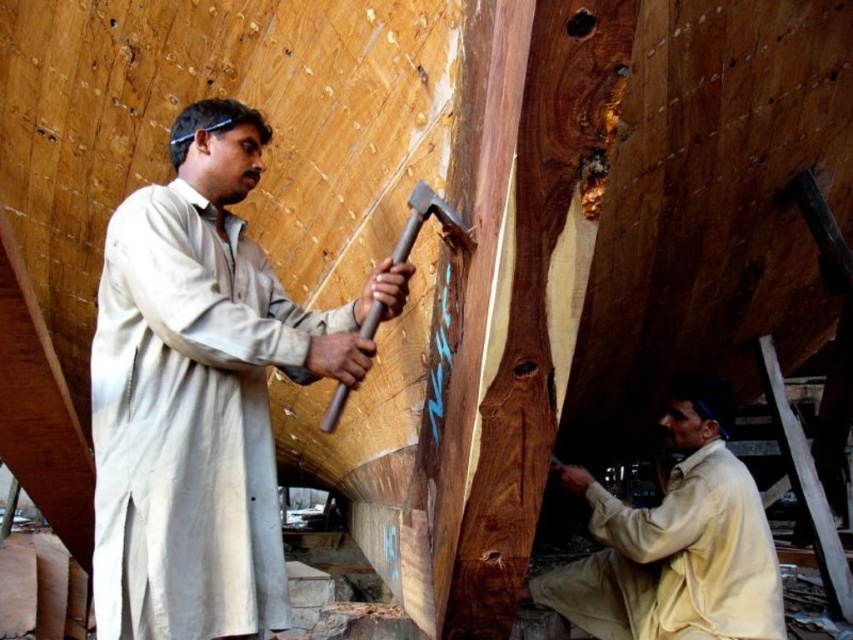
Is point (639, 632) positioned after point (329, 406)?

Yes.

Locate an element on the screen. This screenshot has height=640, width=853. light beige fabric at lower right is located at coordinates (676, 540).

In the scene shown: Who is more distant from viewer, (694, 436) or (413, 225)?

The point (694, 436) is more distant.

At what (x,y) coordinates should I click in order to perform the action: click on light beige fabric at lower right. Please return your answer as a coordinate pair (x, y). The image size is (853, 640). Looking at the image, I should click on (676, 540).

Which is above, light beige fabric shirt at left or wooden handle hammer at center?

wooden handle hammer at center

Is light beige fabric shirt at left further to camera compared to wooden handle hammer at center?

That is True.

Does point (154, 557) lie behind point (328, 422)?

Yes, point (154, 557) is behind point (328, 422).

Where is `light beige fabric shirt at left`? The height and width of the screenshot is (640, 853). light beige fabric shirt at left is located at coordinates (201, 392).

Who is positioned more to the left, light beige fabric shirt at left or light beige fabric at lower right?

Positioned to the left is light beige fabric shirt at left.

Can you confirm if light beige fabric shirt at left is thinner than light beige fabric at lower right?

In fact, light beige fabric shirt at left might be wider than light beige fabric at lower right.

The image size is (853, 640). Describe the element at coordinates (201, 392) in the screenshot. I see `light beige fabric shirt at left` at that location.

At what (x,y) coordinates should I click in order to perform the action: click on light beige fabric shirt at left. Please return your answer as a coordinate pair (x, y). The height and width of the screenshot is (640, 853). Looking at the image, I should click on (201, 392).